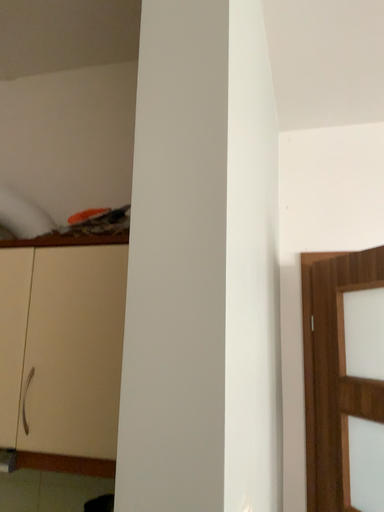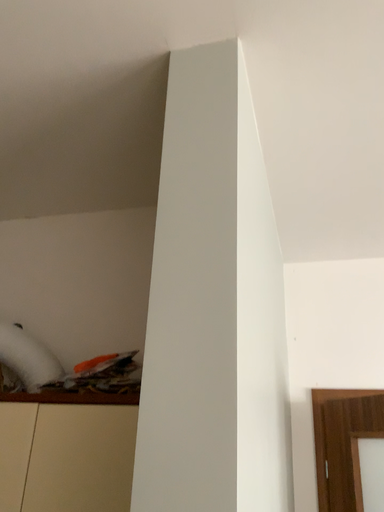
Question: Which way did the camera rotate in the video?

Choices:
 (A) rotated downward
 (B) rotated upward

Answer: (B)